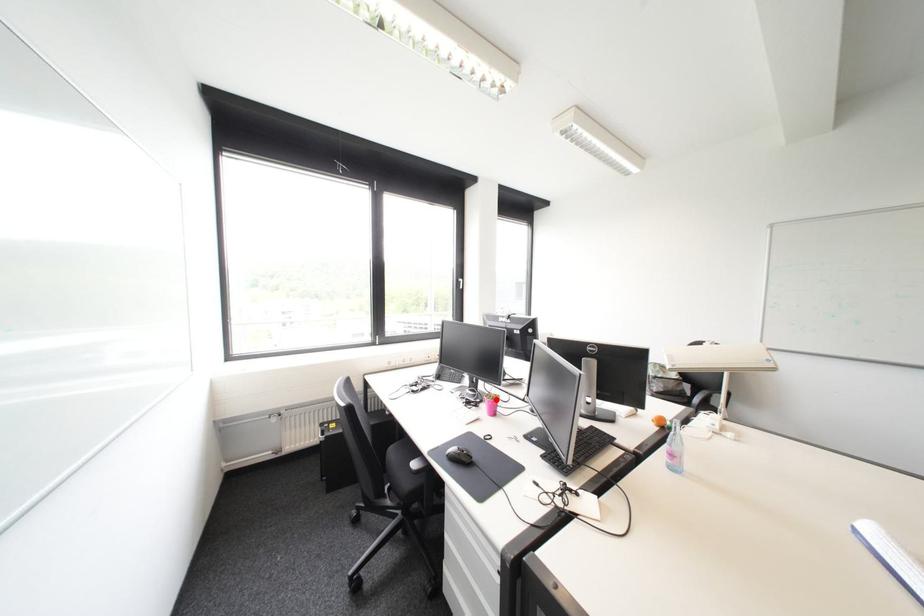
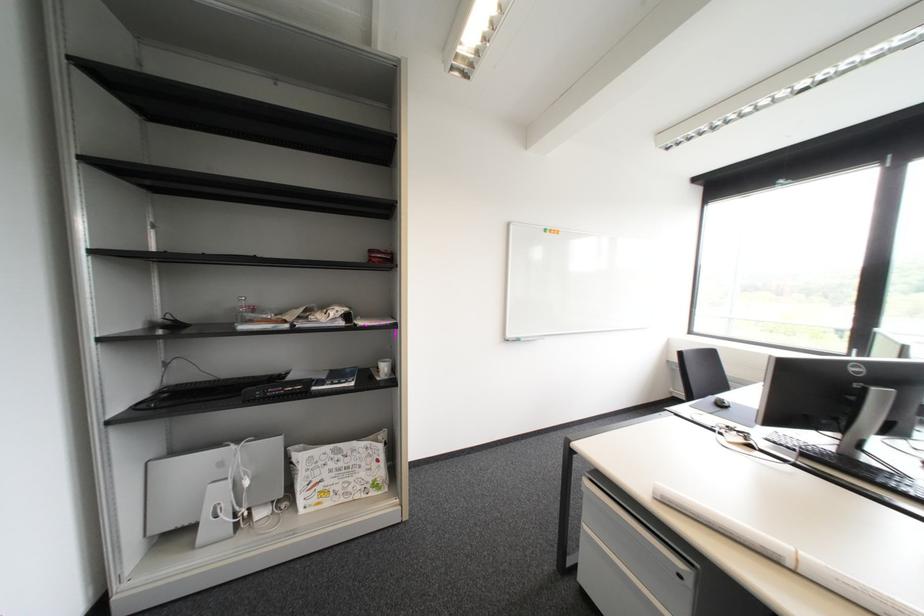
Question: I am providing you with two images of the same scene from different viewpoints. A red point is marked on the first image. Can you still see the location of the red point in image 2?

Choices:
 (A) Yes
 (B) No

Answer: (B)